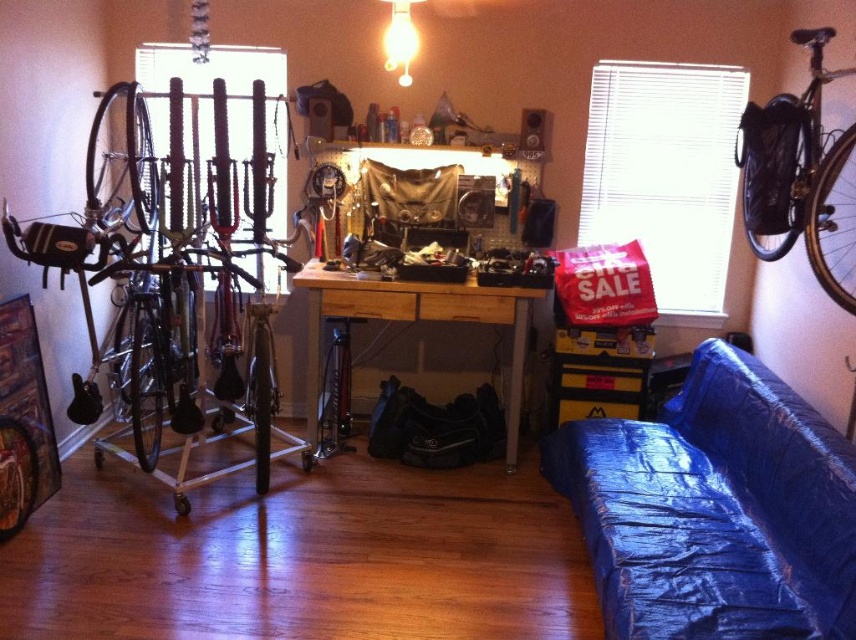
Between shiny black bicycle at upper right and wooden desk at center, which one has more height?

With more height is shiny black bicycle at upper right.

Is shiny black bicycle at upper right shorter than wooden desk at center?

No.

Find the location of a particular element. This screenshot has height=640, width=856. shiny black bicycle at upper right is located at coordinates (798, 176).

The height and width of the screenshot is (640, 856). What are the coordinates of `shiny black bike at left` in the screenshot? It's located at (175, 280).

Based on the photo, who is more forward, (x=97, y=122) or (x=752, y=182)?

Point (x=97, y=122) is more forward.

You are a GUI agent. You are given a task and a screenshot of the screen. Output one action in this format:
    pyautogui.click(x=<x>, y=<y>)
    Task: Click on the shiny black bike at left
    The height and width of the screenshot is (640, 856).
    Given the screenshot: What is the action you would take?
    point(175,280)